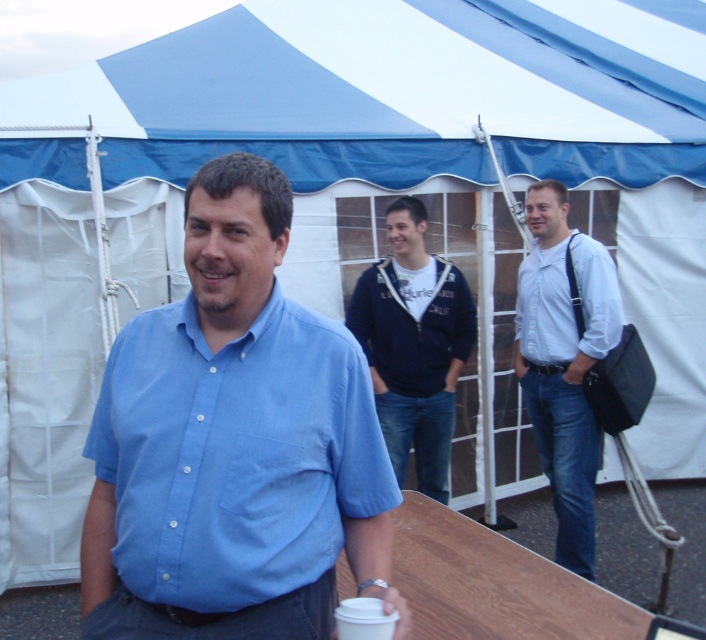
You are at an outdoor event under a tent and need to place a small item on the wooden table at lower center. Considering the size of the white paper cup at lower center already on the table, will there be enough space?

The wooden table at lower center is larger than the white paper cup at lower center, so there should be enough space to place your small item on the table.